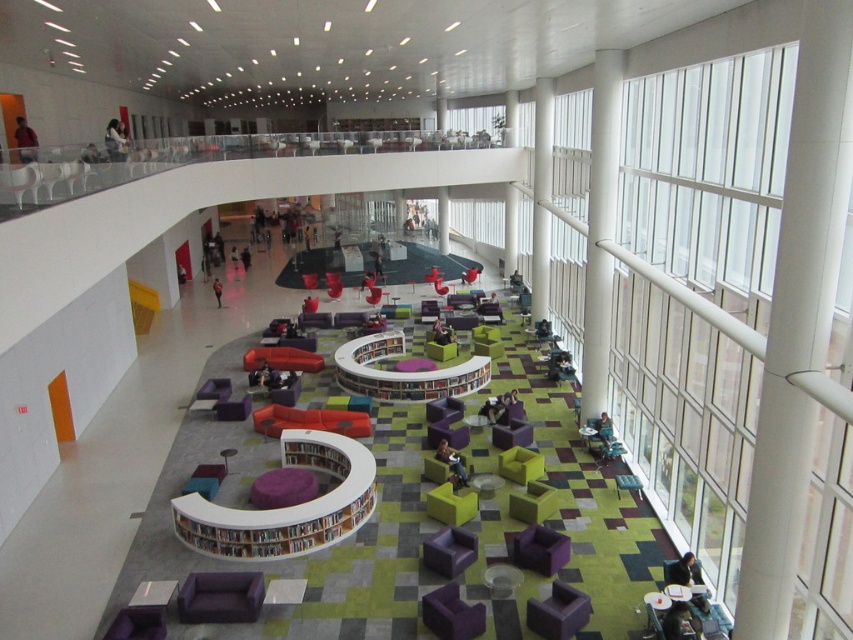
You are an interior designer assessing the space for accessibility. You need to ensure that the teal fabric chair at lower right is visible to someone sitting on the white smooth pillar at right. Considering their heights, will the person on the pillar be able to see over the chair?

The white smooth pillar at right has a greater height compared to the teal fabric chair at lower right. Since the pillar is taller, someone sitting on it would likely have an unobstructed view over the teal fabric chair at lower right.

You are sitting on the purple fabric couches at center and want to reach the white wood bookshelf at center. Which direction should you move to get closer to the bookshelf?

You should move backward because the purple fabric couches at center are in front of the white wood bookshelf at center, so moving backward would bring you closer to the bookshelf.